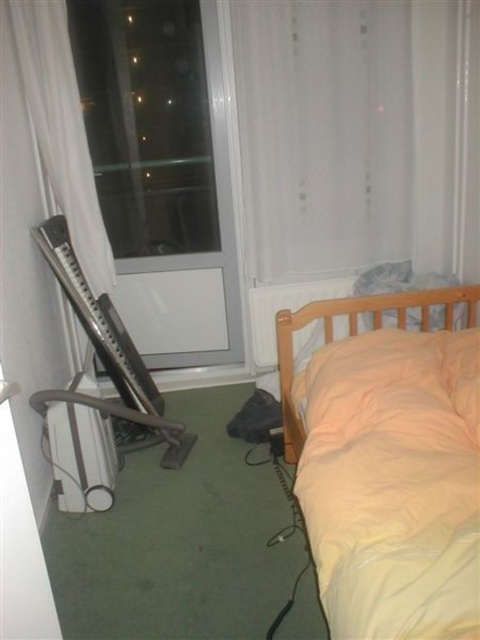
You are trying to decide whether to place a large potted plant in this bedroom. The plant requires a space that is at least as big as the transparent plastic screen door at left. Can the light orange fabric bed at right accommodate the plant?

The transparent plastic screen door at left is bigger than the light orange fabric bed at right, so the light orange fabric bed at right is not big enough to accommodate the plant.

You are moving a large painting that is 1.5 meters wide. You want to place it on the wall between the transparent plastic screen door at left and the white sheer curtain at left. Can the painting fit in that space?

The transparent plastic screen door at left is wider than the white sheer curtain at left. Since the painting is 1.5 meters wide, we need to know the exact width of the space between them. However, the description only states that the screen door is wider than the curtain, but not the actual dimensions. Therefore, it is uncertain if the painting will fit without more information about the space between the two objects.